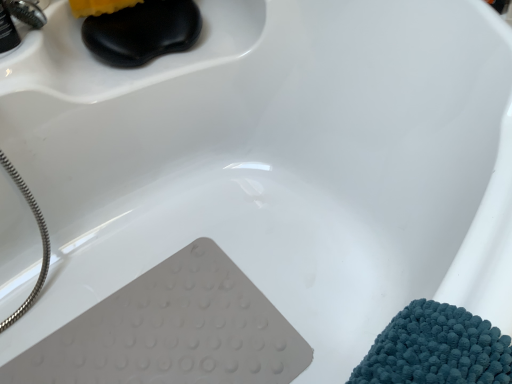
This screenshot has height=384, width=512. What do you see at coordinates (20, 20) in the screenshot?
I see `brushed metal faucet at upper left, which ranks as the first faucet in front-to-back order` at bounding box center [20, 20].

In order to click on brushed metal faucet at upper left, which is the 2th faucet from back to front in this screenshot , I will do `click(20, 20)`.

Measure the distance between brushed metal faucet at upper left, which is the 2th faucet from back to front, and camera.

brushed metal faucet at upper left, which is the 2th faucet from back to front, and camera are 31.63 inches apart.

The image size is (512, 384). Find the location of `brushed metal faucet at upper left, the second faucet in the front-to-back sequence`. brushed metal faucet at upper left, the second faucet in the front-to-back sequence is located at coordinates (27, 12).

What do you see at coordinates (27, 12) in the screenshot? This screenshot has height=384, width=512. I see `brushed metal faucet at upper left, placed as the first faucet when sorted from back to front` at bounding box center [27, 12].

This screenshot has width=512, height=384. Identify the location of brushed metal faucet at upper left, which ranks as the first faucet in front-to-back order. (20, 20).

Which object is positioned more to the left, brushed metal faucet at upper left, which is the 2th faucet from back to front, or brushed metal faucet at upper left, placed as the first faucet when sorted from back to front?

Positioned to the left is brushed metal faucet at upper left, which is the 2th faucet from back to front.

Is brushed metal faucet at upper left, which is the 2th faucet from back to front, closer to camera compared to brushed metal faucet at upper left, placed as the first faucet when sorted from back to front?

Yes, brushed metal faucet at upper left, which is the 2th faucet from back to front, is closer to the camera.

Is point (34, 20) farther from camera compared to point (40, 8)?

No, it is not.

From the image's perspective, which is below, brushed metal faucet at upper left, which is the 2th faucet from back to front, or brushed metal faucet at upper left, the second faucet in the front-to-back sequence?

brushed metal faucet at upper left, which is the 2th faucet from back to front, from the image's perspective.

In the scene shown: From a real-world perspective, which is physically below, brushed metal faucet at upper left, which is the 2th faucet from back to front, or brushed metal faucet at upper left, placed as the first faucet when sorted from back to front?

In real-world perspective, brushed metal faucet at upper left, placed as the first faucet when sorted from back to front, is lower.

Between brushed metal faucet at upper left, which is the 2th faucet from back to front, and brushed metal faucet at upper left, the second faucet in the front-to-back sequence, which one has larger width?

brushed metal faucet at upper left, which is the 2th faucet from back to front, is wider.

Does brushed metal faucet at upper left, which is the 2th faucet from back to front, have a lesser height compared to brushed metal faucet at upper left, the second faucet in the front-to-back sequence?

No.

In terms of size, does brushed metal faucet at upper left, which ranks as the first faucet in front-to-back order, appear bigger or smaller than brushed metal faucet at upper left, placed as the first faucet when sorted from back to front?

brushed metal faucet at upper left, which ranks as the first faucet in front-to-back order, is bigger than brushed metal faucet at upper left, placed as the first faucet when sorted from back to front.

In the scene shown: Which is correct: brushed metal faucet at upper left, which is the 2th faucet from back to front, is inside brushed metal faucet at upper left, the second faucet in the front-to-back sequence, or outside of it?

brushed metal faucet at upper left, which is the 2th faucet from back to front, is outside brushed metal faucet at upper left, the second faucet in the front-to-back sequence.

Is brushed metal faucet at upper left, which is the 2th faucet from back to front, far from brushed metal faucet at upper left, the second faucet in the front-to-back sequence?

No.

Is brushed metal faucet at upper left, which ranks as the first faucet in front-to-back order, looking in the opposite direction of brushed metal faucet at upper left, the second faucet in the front-to-back sequence?

That's not correct — brushed metal faucet at upper left, which ranks as the first faucet in front-to-back order, is not looking away from brushed metal faucet at upper left, the second faucet in the front-to-back sequence.

Measure the distance from brushed metal faucet at upper left, which ranks as the first faucet in front-to-back order, to brushed metal faucet at upper left, the second faucet in the front-to-back sequence.

brushed metal faucet at upper left, which ranks as the first faucet in front-to-back order, is 0.73 inches from brushed metal faucet at upper left, the second faucet in the front-to-back sequence.

The height and width of the screenshot is (384, 512). What are the coordinates of `faucet that is below the brushed metal faucet at upper left, the second faucet in the front-to-back sequence (from the image's perspective)` in the screenshot? It's located at (20, 20).

Consider the image. Considering the relative positions of brushed metal faucet at upper left, the second faucet in the front-to-back sequence, and brushed metal faucet at upper left, which ranks as the first faucet in front-to-back order, in the image provided, is brushed metal faucet at upper left, the second faucet in the front-to-back sequence, to the right of brushed metal faucet at upper left, which ranks as the first faucet in front-to-back order, from the viewer's perspective?

Yes, brushed metal faucet at upper left, the second faucet in the front-to-back sequence, is to the right of brushed metal faucet at upper left, which ranks as the first faucet in front-to-back order.

Is brushed metal faucet at upper left, placed as the first faucet when sorted from back to front, in front of brushed metal faucet at upper left, which is the 2th faucet from back to front?

That is False.

Is point (20, 15) positioned in front of point (3, 28)?

That is False.

From the image's perspective, relative to brushed metal faucet at upper left, which is the 2th faucet from back to front, is brushed metal faucet at upper left, placed as the first faucet when sorted from back to front, above or below?

Based on their image positions, brushed metal faucet at upper left, placed as the first faucet when sorted from back to front, is located above brushed metal faucet at upper left, which is the 2th faucet from back to front.

From a real-world perspective, which is physically above, brushed metal faucet at upper left, placed as the first faucet when sorted from back to front, or brushed metal faucet at upper left, which is the 2th faucet from back to front?

brushed metal faucet at upper left, which is the 2th faucet from back to front, from a real-world perspective.

Which of these two, brushed metal faucet at upper left, the second faucet in the front-to-back sequence, or brushed metal faucet at upper left, which is the 2th faucet from back to front, is wider?

With larger width is brushed metal faucet at upper left, which is the 2th faucet from back to front.

Can you confirm if brushed metal faucet at upper left, the second faucet in the front-to-back sequence, is shorter than brushed metal faucet at upper left, which ranks as the first faucet in front-to-back order?

Correct, brushed metal faucet at upper left, the second faucet in the front-to-back sequence, is not as tall as brushed metal faucet at upper left, which ranks as the first faucet in front-to-back order.

Between brushed metal faucet at upper left, the second faucet in the front-to-back sequence, and brushed metal faucet at upper left, which is the 2th faucet from back to front, which one has smaller size?

Smaller between the two is brushed metal faucet at upper left, the second faucet in the front-to-back sequence.

Is brushed metal faucet at upper left, the second faucet in the front-to-back sequence, inside or outside of brushed metal faucet at upper left, which is the 2th faucet from back to front?

brushed metal faucet at upper left, the second faucet in the front-to-back sequence, lies outside brushed metal faucet at upper left, which is the 2th faucet from back to front.

Can you see brushed metal faucet at upper left, placed as the first faucet when sorted from back to front, touching brushed metal faucet at upper left, which is the 2th faucet from back to front?

Yes, brushed metal faucet at upper left, placed as the first faucet when sorted from back to front, is right next to brushed metal faucet at upper left, which is the 2th faucet from back to front, and making contact.

Consider the image. Is brushed metal faucet at upper left, placed as the first faucet when sorted from back to front, oriented towards brushed metal faucet at upper left, which ranks as the first faucet in front-to-back order?

No, brushed metal faucet at upper left, placed as the first faucet when sorted from back to front, is not oriented towards brushed metal faucet at upper left, which ranks as the first faucet in front-to-back order.

Image resolution: width=512 pixels, height=384 pixels. I want to click on faucet in front of the brushed metal faucet at upper left, placed as the first faucet when sorted from back to front, so click(20, 20).

Identify the location of faucet in front of the brushed metal faucet at upper left, the second faucet in the front-to-back sequence. The width and height of the screenshot is (512, 384). (20, 20).

Where is `faucet above the brushed metal faucet at upper left, placed as the first faucet when sorted from back to front (from a real-world perspective)`? faucet above the brushed metal faucet at upper left, placed as the first faucet when sorted from back to front (from a real-world perspective) is located at coordinates pos(20,20).